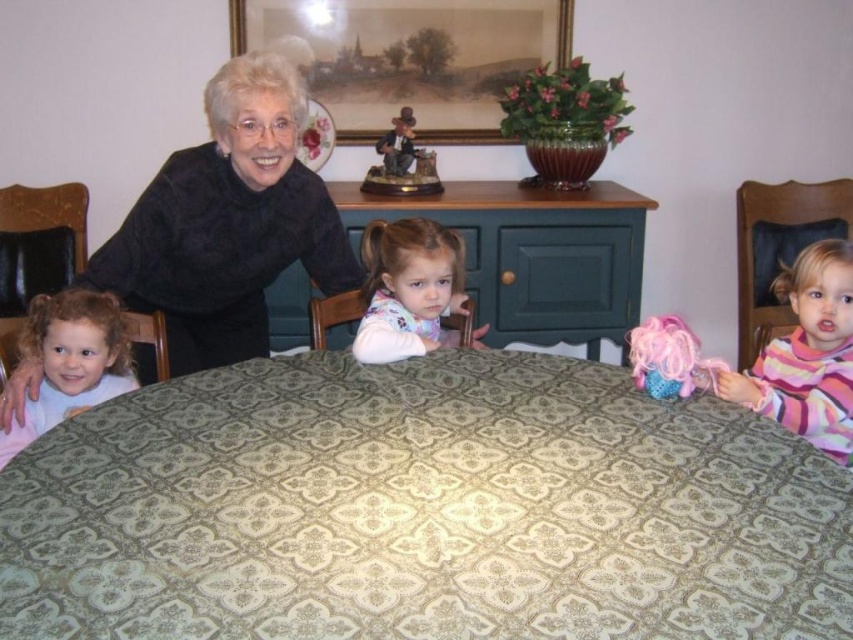
Between wooden framed picture at upper center and green fabric table at center, which one is positioned higher?

wooden framed picture at upper center is above.

This screenshot has width=853, height=640. Find the location of `wooden framed picture at upper center`. wooden framed picture at upper center is located at coordinates (409, 58).

Who is more forward, (276, 19) or (636, 317)?

Positioned in front is point (636, 317).

At what (x,y) coordinates should I click in order to perform the action: click on wooden framed picture at upper center. Please return your answer as a coordinate pair (x, y). This screenshot has height=640, width=853. Looking at the image, I should click on (409, 58).

Which is more to the right, green patterned tablecloth at center or curly blonde hair at left?

green patterned tablecloth at center is more to the right.

Which is in front, point (456, 381) or point (47, 404)?

Point (456, 381) is in front.

Locate an element on the screen. green patterned tablecloth at center is located at coordinates (422, 509).

From the picture: Can you confirm if wooden framed picture at upper center is taller than fluffy pink sweater at center?

Correct, wooden framed picture at upper center is much taller as fluffy pink sweater at center.

Is point (277, 8) closer to viewer compared to point (465, 296)?

No.

What are the coordinates of `wooden framed picture at upper center` in the screenshot? It's located at (409, 58).